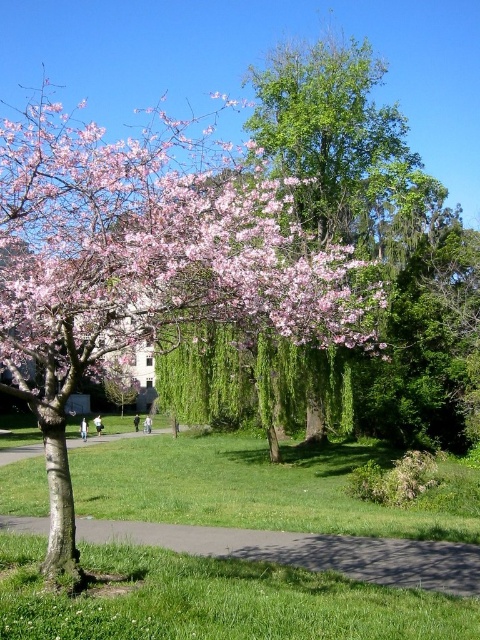
Is green grass at lower left thinner than green asphalt path at lower center?

No.

Does green grass at lower left have a smaller size compared to green asphalt path at lower center?

No.

What do you see at coordinates (228, 604) in the screenshot?
I see `green grass at lower left` at bounding box center [228, 604].

I want to click on green grass at lower left, so click(228, 604).

Does pink bloom at upper left appear under green asphalt path at lower center?

No, pink bloom at upper left is not below green asphalt path at lower center.

Who is higher up, pink bloom at upper left or green asphalt path at lower center?

Positioned higher is pink bloom at upper left.

Identify the location of pink bloom at upper left. (152, 250).

The image size is (480, 640). I want to click on pink bloom at upper left, so click(x=152, y=250).

Where is `pink bloom at upper left`? The height and width of the screenshot is (640, 480). pink bloom at upper left is located at coordinates (152, 250).

In the scene shown: Who is positioned more to the right, pink bloom at upper left or green grass at lower left?

green grass at lower left is more to the right.

Image resolution: width=480 pixels, height=640 pixels. Find the location of `pink bloom at upper left`. pink bloom at upper left is located at coordinates (152, 250).